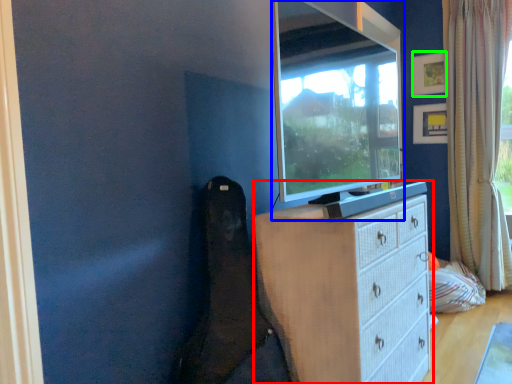
Question: Which object is the farthest from chest of drawers (highlighted by a red box)? Choose among these: television (highlighted by a blue box) or picture frame (highlighted by a green box).

Choices:
 (A) television
 (B) picture frame

Answer: (B)